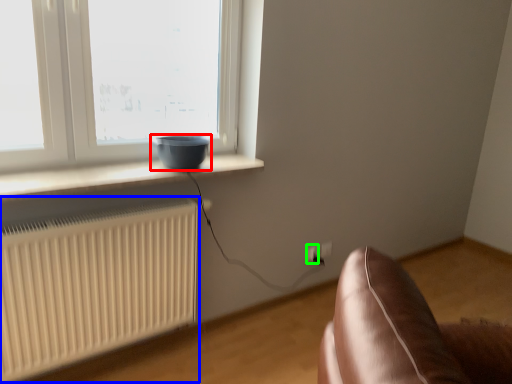
Question: Which object is positioned farthest from bowl (highlighted by a red box)? Select from radiator (highlighted by a blue box) and electric outlet (highlighted by a green box).

Choices:
 (A) radiator
 (B) electric outlet

Answer: (B)